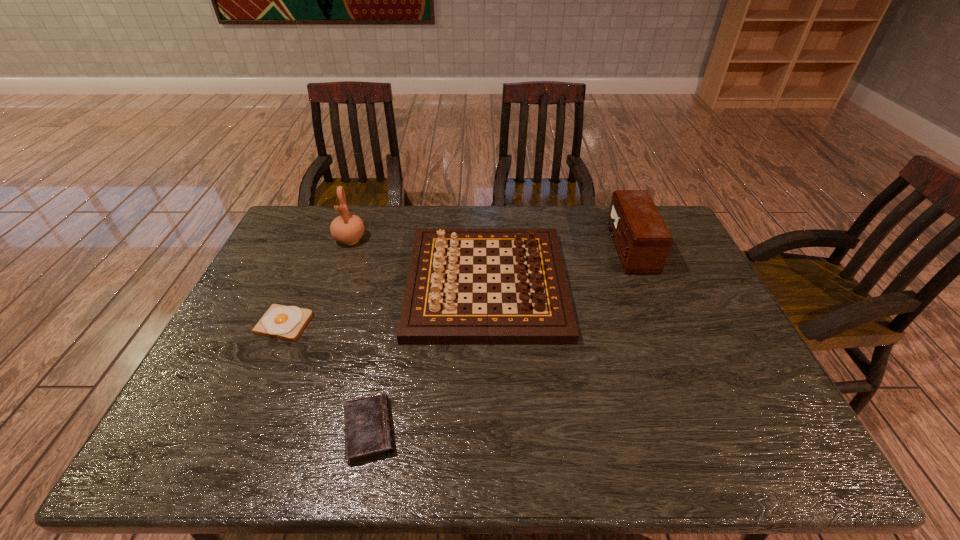
At what (x,y) coordinates should I click in order to perform the action: click on object at the right edge. Please return your answer as a coordinate pair (x, y). The width and height of the screenshot is (960, 540). Looking at the image, I should click on (642, 240).

The width and height of the screenshot is (960, 540). I want to click on object present at the far right corner, so click(642, 240).

In the image, there is a desktop. What are the coordinates of `free space at the far edge` in the screenshot? It's located at (370, 234).

I want to click on free space at the near edge of the desktop, so click(x=503, y=435).

Image resolution: width=960 pixels, height=540 pixels. Identify the location of vacant space at the left edge of the desktop. (201, 401).

You are a GUI agent. You are given a task and a screenshot of the screen. Output one action in this format:
    pyautogui.click(x=<x>, y=<y>)
    Task: Click on the vacant space at the right edge of the desktop
    This screenshot has width=960, height=540.
    Given the screenshot: What is the action you would take?
    pyautogui.click(x=765, y=394)

This screenshot has height=540, width=960. I want to click on free area in between the pottery and the toast, so click(317, 282).

Identify the location of free spot between the diary and the toast. This screenshot has width=960, height=540. (326, 377).

At what (x,y) coordinates should I click in order to perform the action: click on vacant space in between the toast and the nearest object. Please return your answer as a coordinate pair (x, y). Looking at the image, I should click on (326, 377).

Where is `empty location between the tallest object and the diary`? Image resolution: width=960 pixels, height=540 pixels. empty location between the tallest object and the diary is located at coordinates (360, 335).